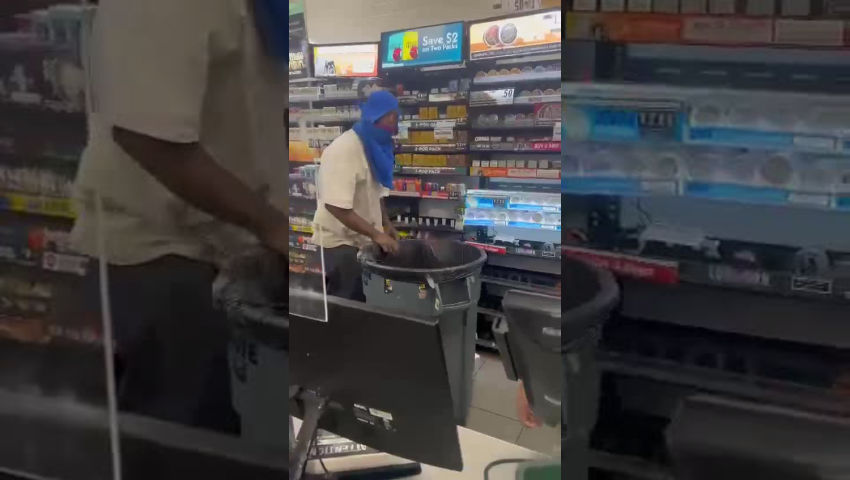
You are a GUI agent. You are given a task and a screenshot of the screen. Output one action in this format:
    pyautogui.click(x=<x>, y=<y>)
    Task: Click on the store wall
    The image size is (850, 480).
    Given the screenshot: What is the action you would take?
    347,21